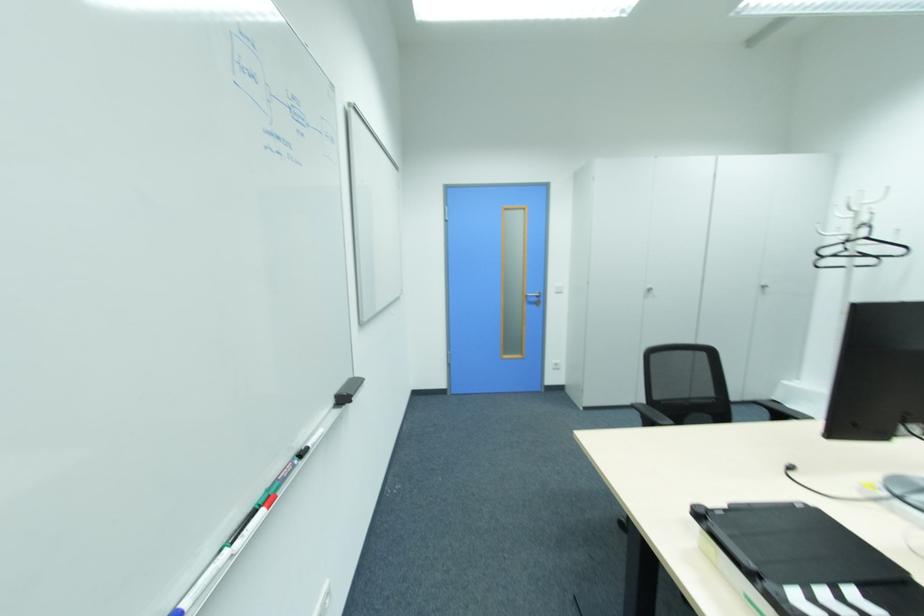
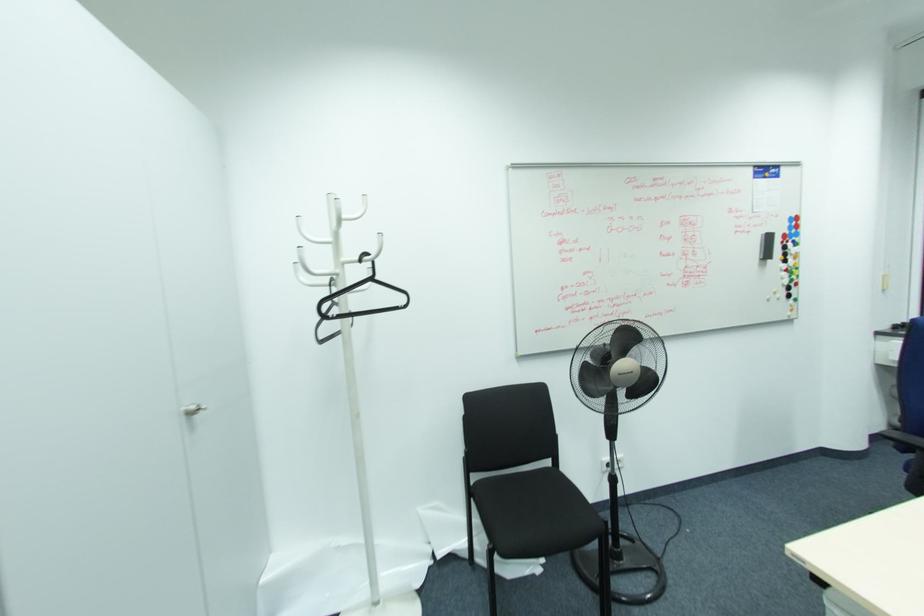
Where in the second image is the point corresponding to pixel 764 285 from the first image?

(191, 408)